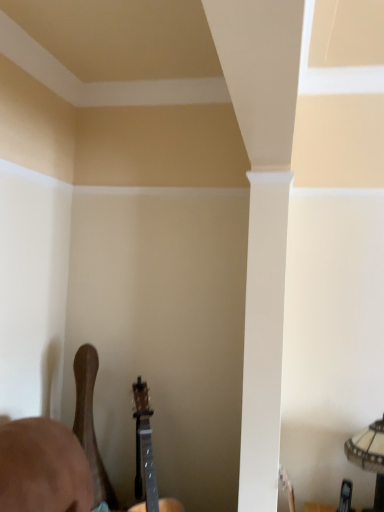
Question: Can you confirm if wooden acoustic guitar at lower left, the 1th guitar when ordered from left to right, is thinner than glass textured lampshade at lower right?

Choices:
 (A) yes
 (B) no

Answer: (A)

Question: Is glass textured lampshade at lower right at the back of wooden acoustic guitar at lower left, arranged as the second guitar when viewed from the right?

Choices:
 (A) no
 (B) yes

Answer: (A)

Question: Considering the relative sizes of wooden acoustic guitar at lower left, the 1th guitar when ordered from left to right, and glass textured lampshade at lower right in the image provided, is wooden acoustic guitar at lower left, the 1th guitar when ordered from left to right, bigger than glass textured lampshade at lower right?

Choices:
 (A) yes
 (B) no

Answer: (A)

Question: From a real-world perspective, is wooden acoustic guitar at lower left, the 1th guitar when ordered from left to right, on top of glass textured lampshade at lower right?

Choices:
 (A) no
 (B) yes

Answer: (B)

Question: Is glass textured lampshade at lower right completely or partially inside wooden acoustic guitar at lower left, the 1th guitar when ordered from left to right?

Choices:
 (A) yes
 (B) no

Answer: (B)

Question: Based on their positions, is wooden acoustic guitar at lower left, the 1th guitar when ordered from left to right, located to the left or right of glass textured lampshade at lower right?

Choices:
 (A) right
 (B) left

Answer: (B)

Question: Is wooden acoustic guitar at lower left, the 1th guitar when ordered from left to right, spatially inside glass textured lampshade at lower right, or outside of it?

Choices:
 (A) outside
 (B) inside

Answer: (A)

Question: Is wooden acoustic guitar at lower left, arranged as the second guitar when viewed from the right, in front of or behind glass textured lampshade at lower right in the image?

Choices:
 (A) front
 (B) behind

Answer: (B)

Question: In terms of size, does wooden acoustic guitar at lower left, the 1th guitar when ordered from left to right, appear bigger or smaller than glass textured lampshade at lower right?

Choices:
 (A) small
 (B) big

Answer: (B)

Question: Is glass textured lampshade at lower right taller or shorter than wooden acoustic guitar at lower center, acting as the first guitar starting from the right?

Choices:
 (A) tall
 (B) short

Answer: (B)

Question: Visually, is glass textured lampshade at lower right positioned to the left or to the right of wooden acoustic guitar at lower center, acting as the first guitar starting from the right?

Choices:
 (A) right
 (B) left

Answer: (A)

Question: Is point (382, 450) positioned closer to the camera than point (177, 501)?

Choices:
 (A) farther
 (B) closer

Answer: (B)

Question: Looking at their shapes, would you say glass textured lampshade at lower right is wider or thinner than wooden acoustic guitar at lower center, acting as the first guitar starting from the right?

Choices:
 (A) thin
 (B) wide

Answer: (A)

Question: Is glass textured lampshade at lower right bigger or smaller than wooden acoustic guitar at lower left, the 1th guitar when ordered from left to right?

Choices:
 (A) small
 (B) big

Answer: (A)

Question: Is point (382, 458) closer or farther from the camera than point (94, 501)?

Choices:
 (A) farther
 (B) closer

Answer: (B)